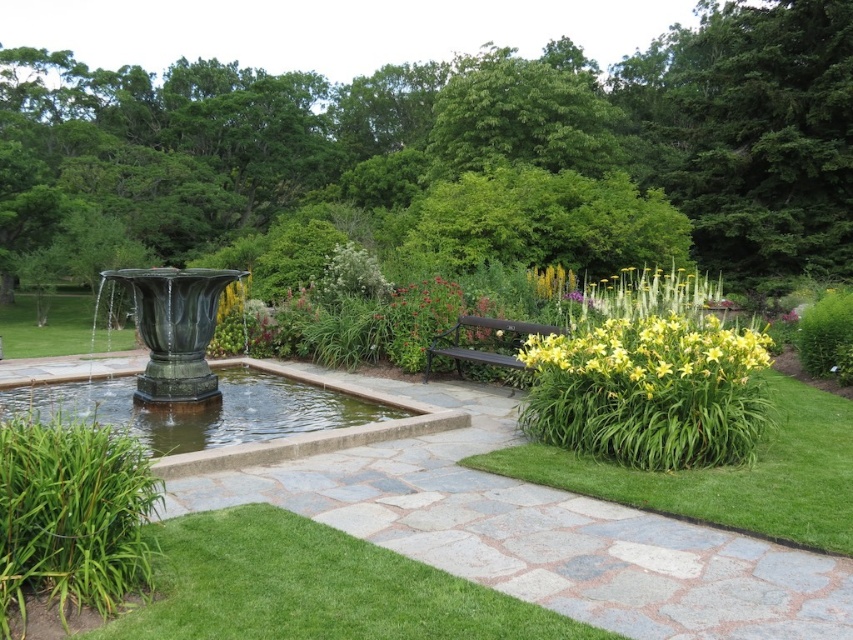
You are standing in the garden scene and want to place a small decorative statue exactly at the center of the garden. Given the green grass at lower left, where would you position the statue to ensure it is centered?

The green grass at lower left is located at point (312,588). To center the statue, you would need to position it at the midpoint between this point and the opposite corner of the garden, which would be point (538,51).